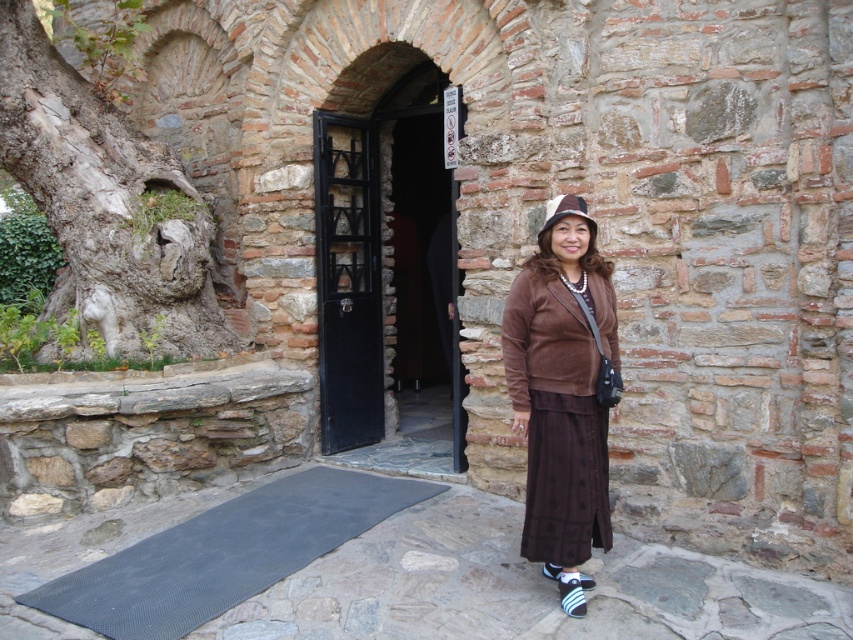
Question: From the image, what is the correct spatial relationship of gray rough bark tree at left in relation to black rubber mat at lower center?

Choices:
 (A) right
 (B) left

Answer: (B)

Question: Which is nearer to the black rubber mat at lower center?

Choices:
 (A) brown felt hat at center
 (B) black metal door at center

Answer: (B)

Question: Among these objects, which one is farthest from the camera?

Choices:
 (A) black rubber mat at lower center
 (B) brown suede skirt at center
 (C) brown felt hat at center

Answer: (C)

Question: In this image, where is brown suede skirt at center located relative to black rubber mat at lower center?

Choices:
 (A) below
 (B) above

Answer: (B)

Question: Which object is closer to the camera taking this photo?

Choices:
 (A) black metal door at center
 (B) gray rough bark tree at left

Answer: (B)

Question: Is black rubber mat at lower center thinner than brown felt hat at center?

Choices:
 (A) no
 (B) yes

Answer: (A)